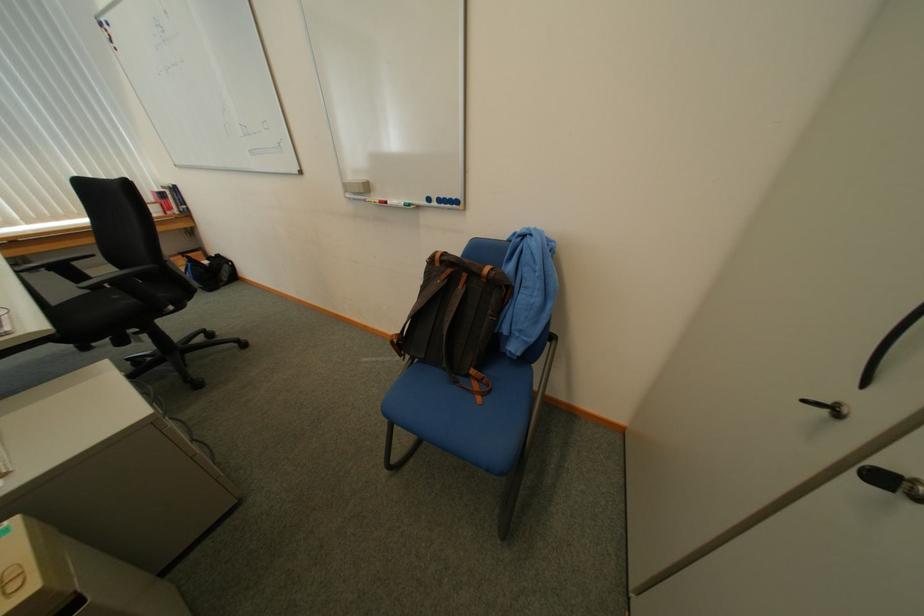
In order to click on chair sitting surface in this screenshot , I will do `click(485, 419)`.